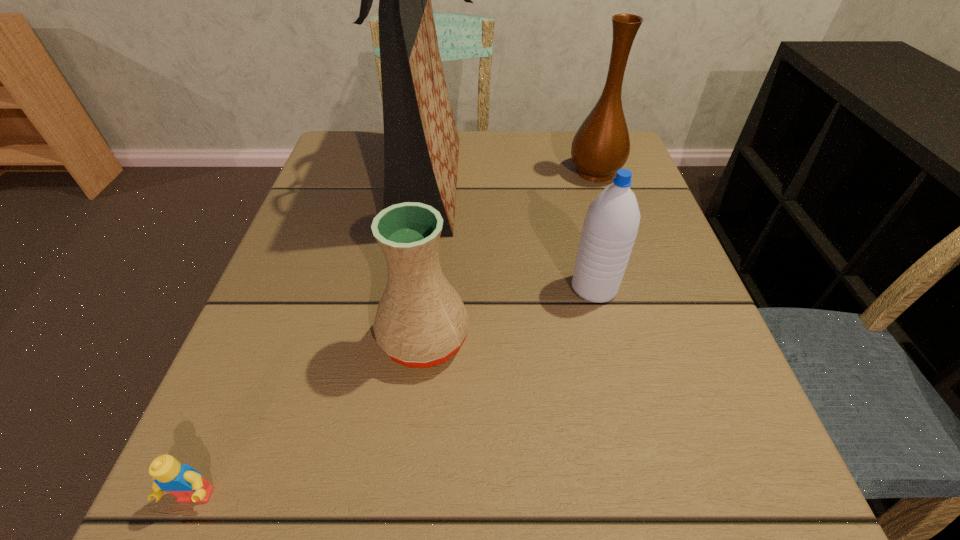
What are the coordinates of `vacant area at the far edge of the desktop` in the screenshot? It's located at (528, 136).

Where is `blank space at the left edge`? Image resolution: width=960 pixels, height=540 pixels. blank space at the left edge is located at coordinates (225, 438).

The image size is (960, 540). In the image, there is a desktop. In order to click on vacant space at the right edge in this screenshot , I will do `click(634, 381)`.

Where is `free space at the far right corner`? The width and height of the screenshot is (960, 540). free space at the far right corner is located at coordinates (568, 150).

Identify the location of free space at the near right corner. The image size is (960, 540). (731, 527).

Where is `unoccupied area between the fourth shortest object and the shopping bag`? unoccupied area between the fourth shortest object and the shopping bag is located at coordinates point(513,177).

The height and width of the screenshot is (540, 960). Identify the location of unoccupied position between the second tallest object and the pottery. (510, 255).

Where is `vacant space that's between the water bottle and the tallest object`? This screenshot has height=540, width=960. vacant space that's between the water bottle and the tallest object is located at coordinates (512, 235).

The width and height of the screenshot is (960, 540). What are the coordinates of `free space between the fourth shortest object and the pottery` in the screenshot? It's located at (510, 255).

The image size is (960, 540). Identify the location of vacant point located between the tallest object and the water bottle. (512, 235).